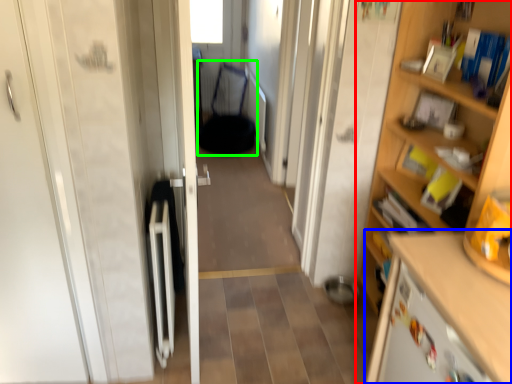
Question: Which object is the farthest from cupboard (highlighted by a red box)? Choose among these: cabinetry (highlighted by a blue box) or armchair (highlighted by a green box).

Choices:
 (A) cabinetry
 (B) armchair

Answer: (B)